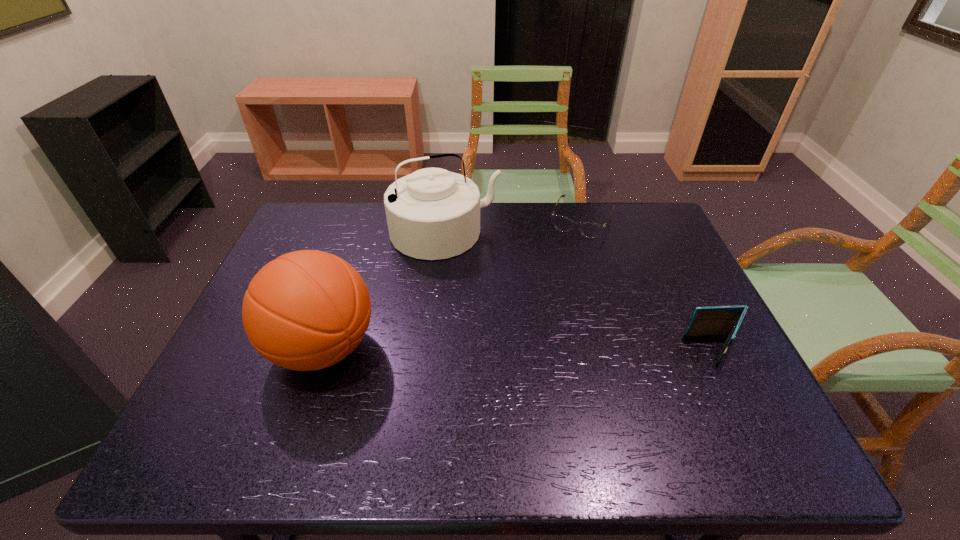
What are the coordinates of `free space on the desktop that is between the basketball and the rightmost object and is positioned on the front-facing side of the third object from left to right` in the screenshot? It's located at (523, 349).

Where is `vacant spot on the desktop that is between the basketball and the rightmost object and is positioned on the spout of the kettle`? vacant spot on the desktop that is between the basketball and the rightmost object and is positioned on the spout of the kettle is located at coordinates (497, 349).